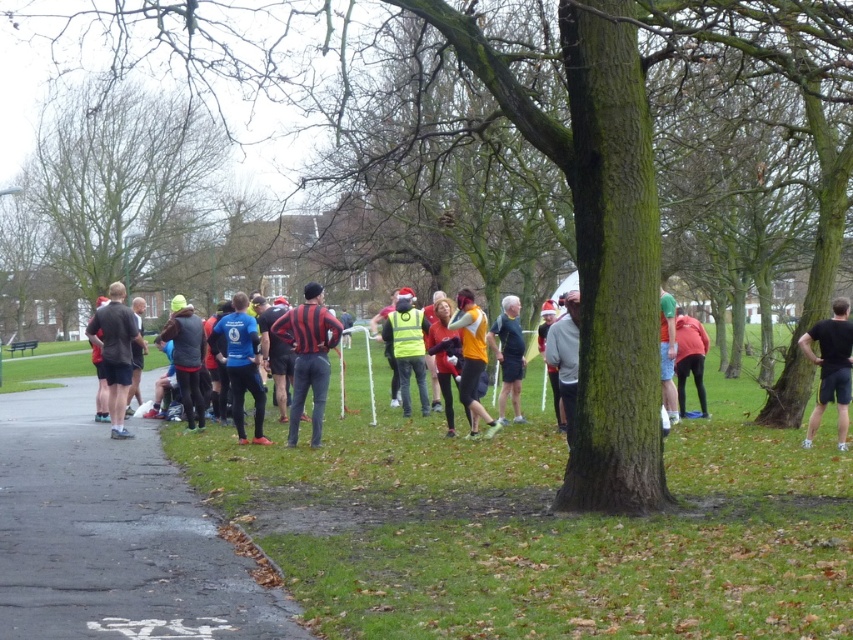
Consider the image. Is high visibility yellow vest at center closer to camera compared to orange fabric jacket at center?

No, it is not.

Between high visibility yellow vest at center and orange fabric jacket at center, which one has less height?

With less height is high visibility yellow vest at center.

Between point (398, 372) and point (471, 417), which one is positioned behind?

Positioned behind is point (398, 372).

The image size is (853, 640). I want to click on high visibility yellow vest at center, so click(x=407, y=348).

Is the position of blue fabric shirt at center more distant than that of matte pink leggings at center?

No, blue fabric shirt at center is in front of matte pink leggings at center.

Between blue fabric shirt at center and matte pink leggings at center, which one has less height?

matte pink leggings at center is shorter.

Where is `blue fabric shirt at center`? The width and height of the screenshot is (853, 640). blue fabric shirt at center is located at coordinates (241, 364).

Is black matte shirt at right bigger than dark gray fabric jacket at left?

Incorrect, black matte shirt at right is not larger than dark gray fabric jacket at left.

Consider the image. Who is positioned more to the left, black matte shirt at right or dark gray fabric jacket at left?

dark gray fabric jacket at left is more to the left.

Where is `black matte shirt at right`? black matte shirt at right is located at coordinates tap(830, 368).